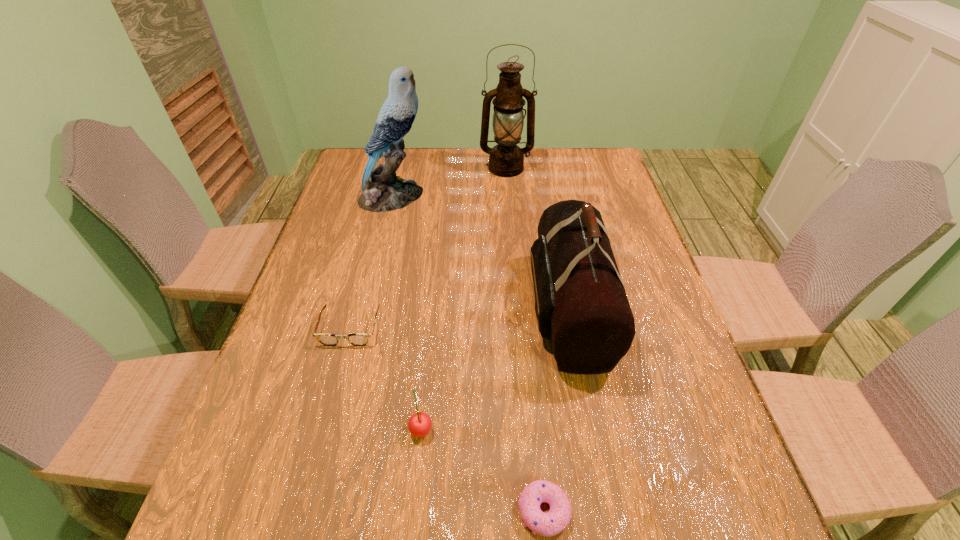
Image resolution: width=960 pixels, height=540 pixels. Identify the location of free spot that satisfies the following two spatial constraints: 1. on the front pocket of the fourth shortest object; 2. on the frame of the spectacles. (572, 328).

The height and width of the screenshot is (540, 960). Identify the location of vacant region that satisfies the following two spatial constraints: 1. on the front side of the farthest object; 2. on the face of the parakeet. (508, 197).

Find the location of a particular element. This screenshot has width=960, height=540. vacant region that satisfies the following two spatial constraints: 1. on the front side of the farthest object; 2. on the face of the second farthest object is located at coordinates (508, 197).

What are the coordinates of `vacant space that satisfies the following two spatial constraints: 1. on the face of the parakeet; 2. on the back side of the third object from left to right` in the screenshot? It's located at (337, 428).